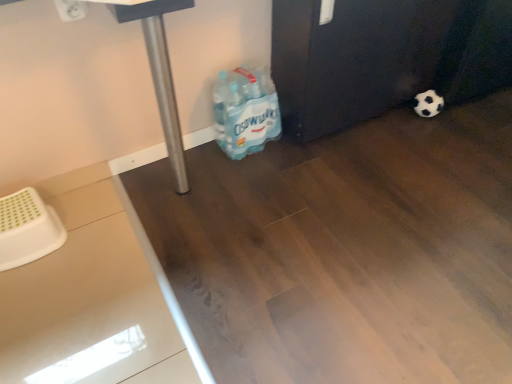
Question: From a real-world perspective, is black and white textured football at lower right physically located above or below blue plastic water bottles at lower center?

Choices:
 (A) below
 (B) above

Answer: (A)

Question: Is point (423, 114) positioned closer to the camera than point (217, 97)?

Choices:
 (A) farther
 (B) closer

Answer: (A)

Question: In the image, is black and white textured football at lower right on the left side or the right side of blue plastic water bottles at lower center?

Choices:
 (A) right
 (B) left

Answer: (A)

Question: From a real-world perspective, is blue plastic water bottles at lower center physically located above or below black and white textured football at lower right?

Choices:
 (A) above
 (B) below

Answer: (A)

Question: Is blue plastic water bottles at lower center bigger or smaller than black and white textured football at lower right?

Choices:
 (A) small
 (B) big

Answer: (B)

Question: Considering the positions of blue plastic water bottles at lower center and black and white textured football at lower right in the image, is blue plastic water bottles at lower center taller or shorter than black and white textured football at lower right?

Choices:
 (A) tall
 (B) short

Answer: (A)

Question: Relative to black and white textured football at lower right, is blue plastic water bottles at lower center in front or behind?

Choices:
 (A) front
 (B) behind

Answer: (A)